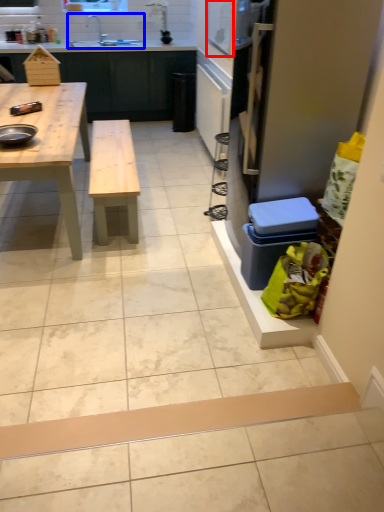
Question: Which object appears farthest to the camera in this image, window screen (highlighted by a red box) or sink (highlighted by a blue box)?

Choices:
 (A) window screen
 (B) sink

Answer: (B)